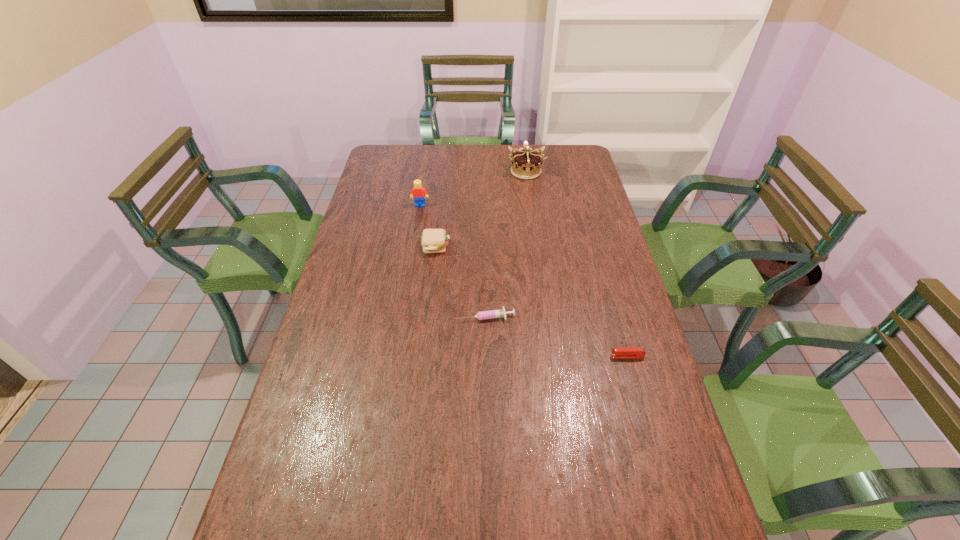
Locate an element on the screen. The height and width of the screenshot is (540, 960). the second object from right to left is located at coordinates (526, 164).

This screenshot has width=960, height=540. In order to click on crown in this screenshot , I will do `click(526, 164)`.

Where is `the second farthest object`? Image resolution: width=960 pixels, height=540 pixels. the second farthest object is located at coordinates click(x=419, y=194).

Locate an element on the screen. patty is located at coordinates (432, 240).

Image resolution: width=960 pixels, height=540 pixels. Identify the location of the third tallest object. (432, 240).

Locate an element on the screen. This screenshot has width=960, height=540. the rightmost object is located at coordinates (619, 352).

The width and height of the screenshot is (960, 540). I want to click on the nearest object, so click(619, 352).

Locate an element on the screen. This screenshot has height=540, width=960. the second nearest object is located at coordinates (499, 313).

At what (x,y) coordinates should I click in order to perform the action: click on the third object from right to left. Please return your answer as a coordinate pair (x, y). Looking at the image, I should click on coord(499,313).

I want to click on free space located 0.050m on the right of the fourth object from left to right, so click(x=556, y=172).